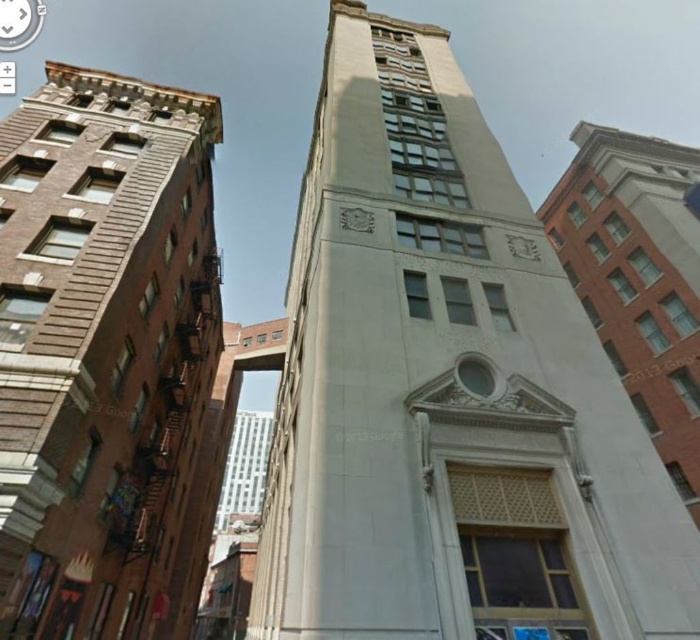
Measure the distance from white stone tower at center to white plastic clock at upper left.

They are 555.27 feet apart.

Can you confirm if white stone tower at center is positioned to the left of white plastic clock at upper left?

Incorrect, white stone tower at center is not on the left side of white plastic clock at upper left.

Is point (284, 579) closer to viewer compared to point (8, 19)?

Yes, point (284, 579) is in front of point (8, 19).

You are a GUI agent. You are given a task and a screenshot of the screen. Output one action in this format:
    pyautogui.click(x=<x>, y=<y>)
    Task: Click on the white stone tower at center
    The height and width of the screenshot is (640, 700).
    Given the screenshot: What is the action you would take?
    pyautogui.click(x=448, y=388)

Between white stone tower at center and brown brick building at left, which one has less height?

With less height is brown brick building at left.

Is point (399, 525) closer to camera compared to point (105, 512)?

That is True.

Does point (421, 81) come closer to viewer compared to point (116, 192)?

No, (421, 81) is behind (116, 192).

This screenshot has height=640, width=700. In order to click on white stone tower at center in this screenshot , I will do [x=448, y=388].

Who is lower down, brown brick building at left or white plastic clock at upper left?

Positioned lower is brown brick building at left.

Can you confirm if brown brick building at left is positioned to the left of white plastic clock at upper left?

Incorrect, brown brick building at left is not on the left side of white plastic clock at upper left.

Describe the element at coordinates (102, 348) in the screenshot. This screenshot has height=640, width=700. I see `brown brick building at left` at that location.

The width and height of the screenshot is (700, 640). I want to click on brown brick building at left, so click(102, 348).